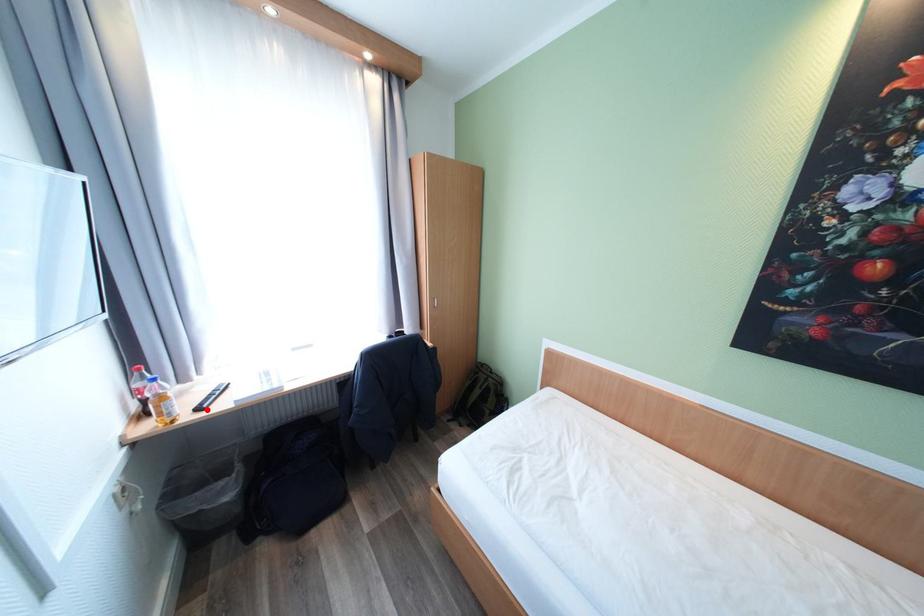
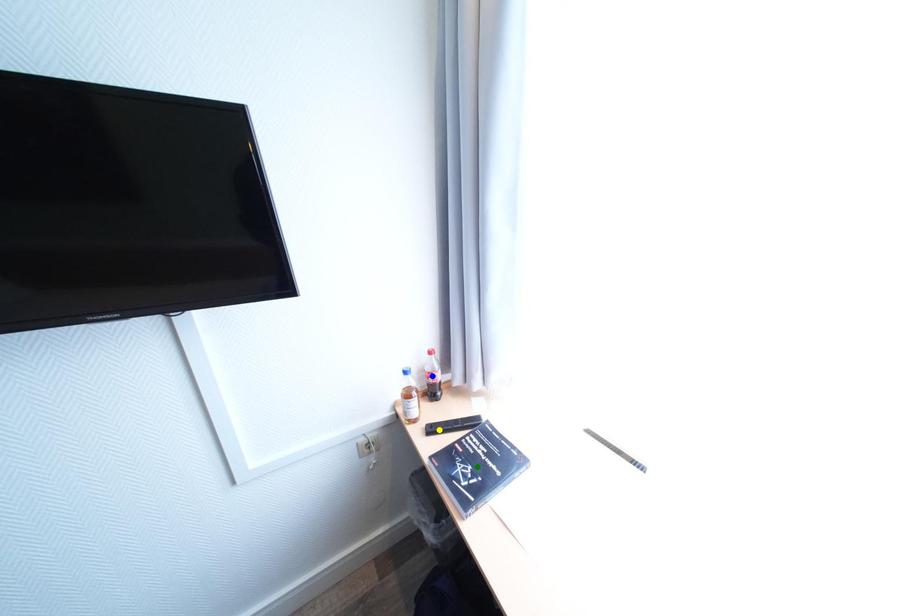
Question: I am providing you with two images of the same scene from different viewpoints. A red point is marked on the first image. You are given multiple points on the second image. Which mark in image 2 goes with the point in image 1?

Choices:
 (A) green point
 (B) yellow point
 (C) blue point

Answer: (B)